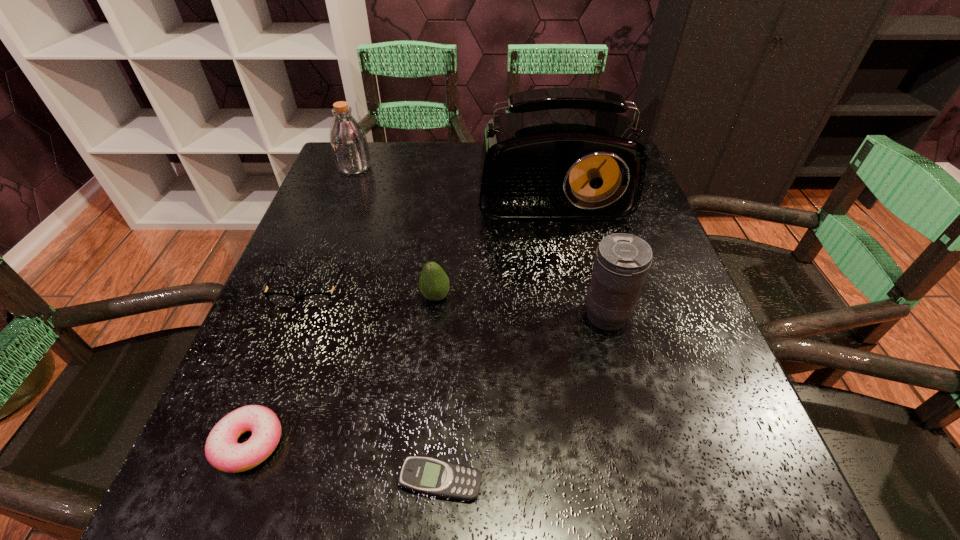
Where is `free point between the tallest object and the telephoto lens`? The height and width of the screenshot is (540, 960). free point between the tallest object and the telephoto lens is located at coordinates (578, 247).

Find the location of a particular element. vacant area that lies between the tallest object and the doughnut is located at coordinates (399, 310).

Where is `vacant area that lies between the telephoto lens and the shortest object`? The height and width of the screenshot is (540, 960). vacant area that lies between the telephoto lens and the shortest object is located at coordinates (523, 398).

Image resolution: width=960 pixels, height=540 pixels. I want to click on empty space that is in between the doughnut and the beeper, so click(x=345, y=462).

Locate an element on the screen. free area in between the shortest object and the tallest object is located at coordinates (495, 329).

Where is `object that is the closest to the tallest object`? The image size is (960, 540). object that is the closest to the tallest object is located at coordinates (434, 284).

Locate an element on the screen. The width and height of the screenshot is (960, 540). object that stands as the third closest to the radio receiver is located at coordinates (348, 141).